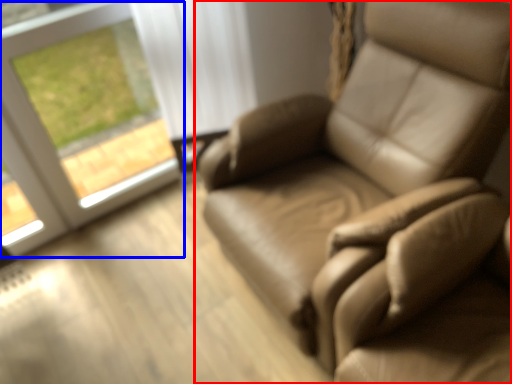
Question: Which of the following is the closest to the observer, chair (highlighted by a red box) or window (highlighted by a blue box)?

Choices:
 (A) chair
 (B) window

Answer: (A)